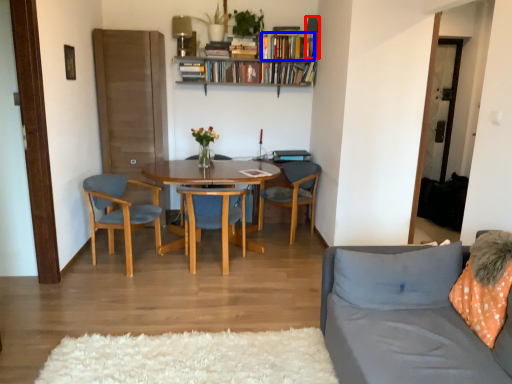
Question: Which object appears farthest to the camera in this image, lamp (highlighted by a red box) or book (highlighted by a blue box)?

Choices:
 (A) lamp
 (B) book

Answer: (B)